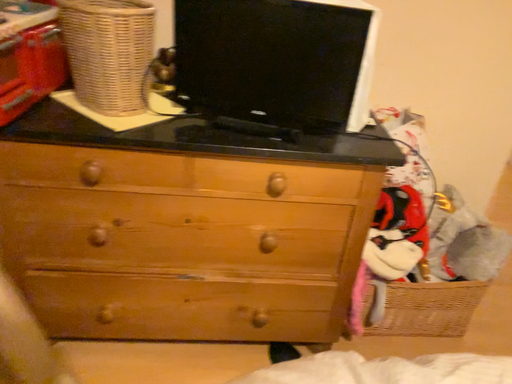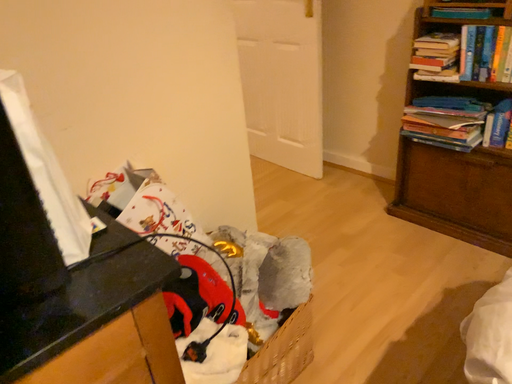
Question: How did the camera likely rotate when shooting the video?

Choices:
 (A) rotated downward
 (B) rotated upward

Answer: (B)